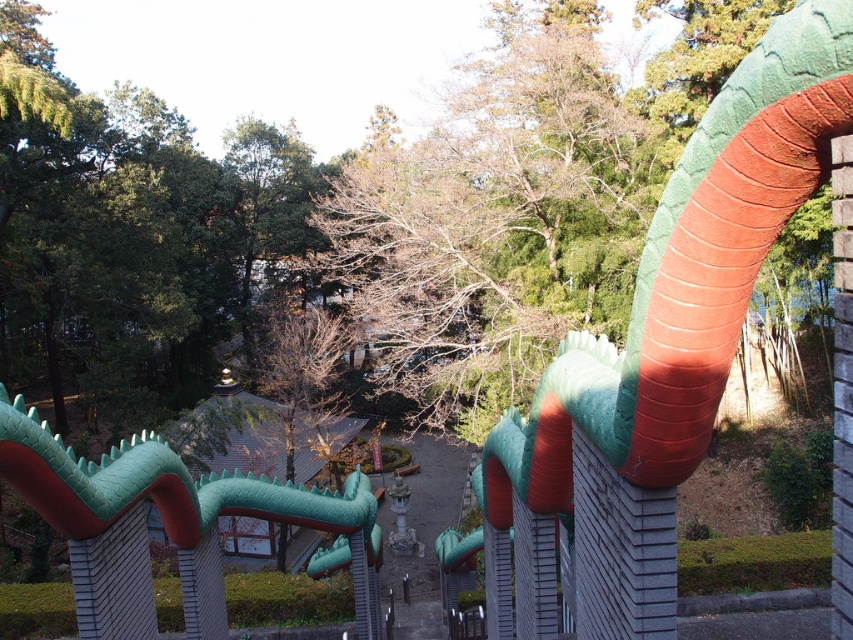
Is point (643, 420) positioned in front of point (93, 544)?

Yes.

Between point (743, 227) and point (107, 621), which one is positioned behind?

Point (107, 621)

Where is `green matte snake at upper center`? Image resolution: width=853 pixels, height=640 pixels. green matte snake at upper center is located at coordinates (662, 348).